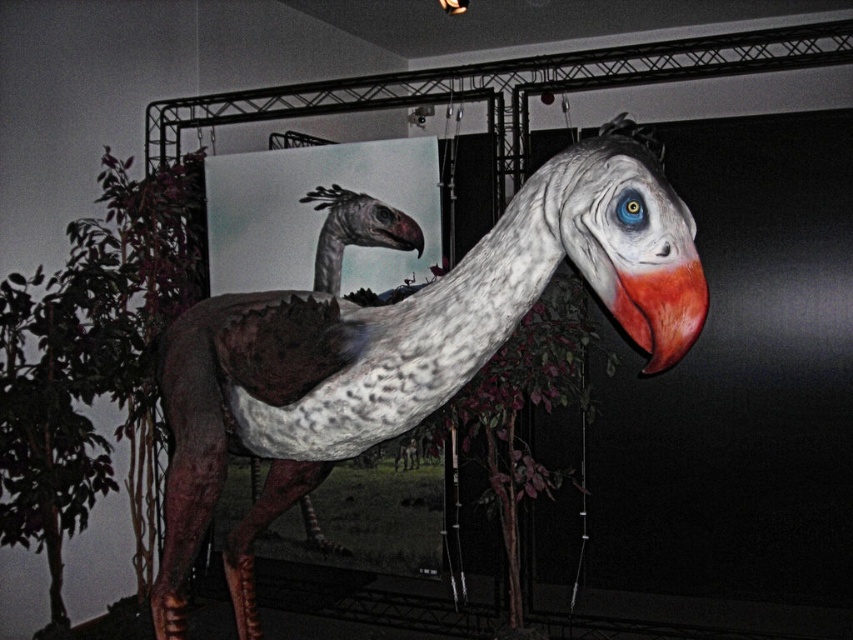
Can you confirm if shiny red beak at center is shorter than matte gray beak at center?

Incorrect, shiny red beak at center's height does not fall short of matte gray beak at center's.

Between point (688, 285) and point (410, 243), which one is positioned in front?

Point (688, 285)

This screenshot has width=853, height=640. Identify the location of shiny red beak at center. click(x=660, y=310).

Is speckled feathered ostrich at center further to camera compared to matte gray beak at center?

No, it is not.

Is speckled feathered ostrich at center below matte gray beak at center?

Yes.

Between point (637, 227) and point (412, 248), which one is positioned in front?

Point (637, 227) is in front.

Locate an element on the screen. This screenshot has width=853, height=640. speckled feathered ostrich at center is located at coordinates [x=381, y=349].

Which is above, speckled feathered ostrich at center or shiny red beak at center?

shiny red beak at center is above.

Who is positioned more to the left, speckled feathered ostrich at center or shiny red beak at center?

speckled feathered ostrich at center

What do you see at coordinates (381, 349) in the screenshot?
I see `speckled feathered ostrich at center` at bounding box center [381, 349].

Locate an element on the screen. This screenshot has height=640, width=853. speckled feathered ostrich at center is located at coordinates (381, 349).